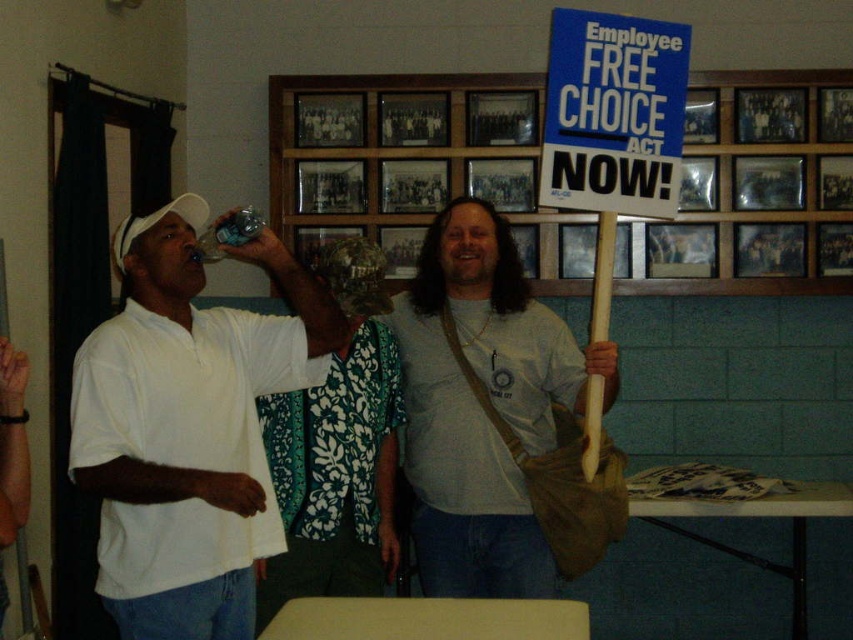
Does blue cardboard sign at upper center come in front of blue paper sign at upper right?

No.

Can you confirm if blue cardboard sign at upper center is positioned above blue paper sign at upper right?

No, blue cardboard sign at upper center is not above blue paper sign at upper right.

Which is behind, point (813, 177) or point (555, 76)?

Positioned behind is point (813, 177).

You are a GUI agent. You are given a task and a screenshot of the screen. Output one action in this format:
    pyautogui.click(x=<x>, y=<y>)
    Task: Click on the blue cardboard sign at upper center
    This screenshot has height=640, width=853.
    Given the screenshot: What is the action you would take?
    pyautogui.click(x=375, y=138)

Between white matte shirt at left and blue paper sign at upper right, which one has more height?

white matte shirt at left is taller.

Does white matte shirt at left have a greater height compared to blue paper sign at upper right?

Correct, white matte shirt at left is much taller as blue paper sign at upper right.

Which is in front, point (131, 250) or point (576, 99)?

Point (131, 250)

Where is `white matte shirt at left`? The image size is (853, 640). white matte shirt at left is located at coordinates (189, 426).

Does light gray cotton shirt at center appear on the left side of blue cardboard sign at upper center?

Correct, you'll find light gray cotton shirt at center to the left of blue cardboard sign at upper center.

Who is shorter, light gray cotton shirt at center or blue cardboard sign at upper center?

Standing shorter between the two is blue cardboard sign at upper center.

The height and width of the screenshot is (640, 853). I want to click on light gray cotton shirt at center, so click(496, 420).